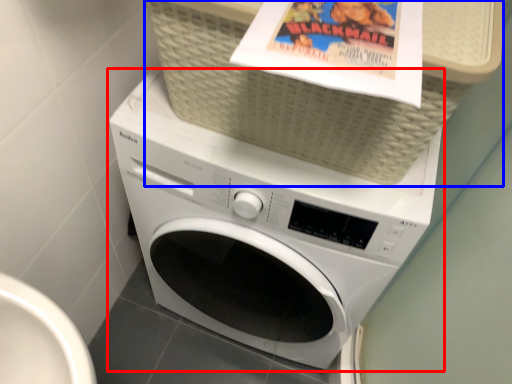
Question: Which object is further to the camera taking this photo, washing machine (highlighted by a red box) or basket (highlighted by a blue box)?

Choices:
 (A) washing machine
 (B) basket

Answer: (A)